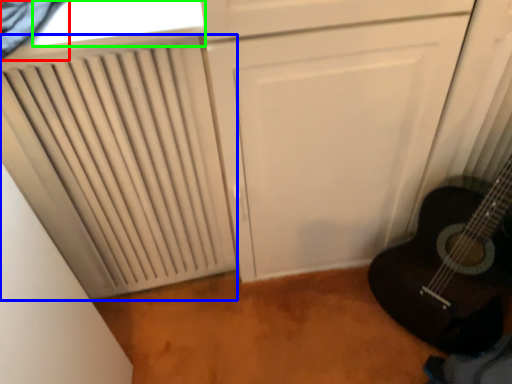
Question: Which object is the farthest from curtain (highlighted by a red box)? Choose among these: radiator (highlighted by a blue box) or window (highlighted by a green box).

Choices:
 (A) radiator
 (B) window

Answer: (A)